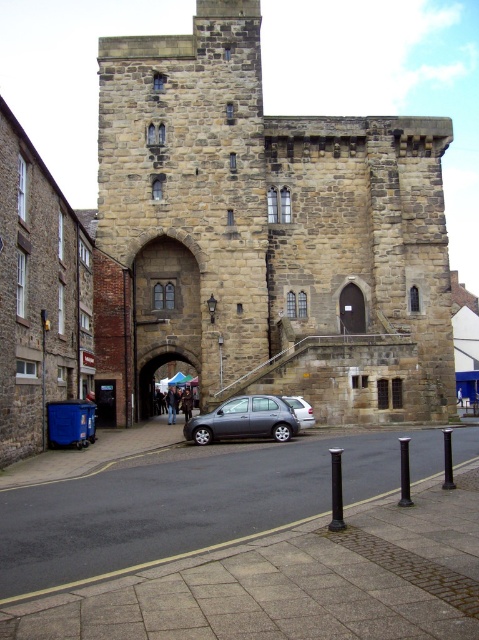
Question: Does stone archway at center appear on the left side of white fabric umbrella at center?

Choices:
 (A) no
 (B) yes

Answer: (B)

Question: Is stone tower at center closer to the viewer compared to white fabric umbrella at center?

Choices:
 (A) no
 (B) yes

Answer: (B)

Question: Which object is the farthest from the stone tower at center?

Choices:
 (A) white fabric umbrella at center
 (B) blue plastic trash can at lower left

Answer: (A)

Question: Among these points, which one is nearest to the camera?

Choices:
 (A) (438, 189)
 (B) (291, 401)

Answer: (B)

Question: Which of the following is the farthest from the observer?

Choices:
 (A) (183, 394)
 (B) (164, 356)

Answer: (A)

Question: Does stone tower at center have a smaller size compared to dark brown stone archway at center?

Choices:
 (A) yes
 (B) no

Answer: (B)